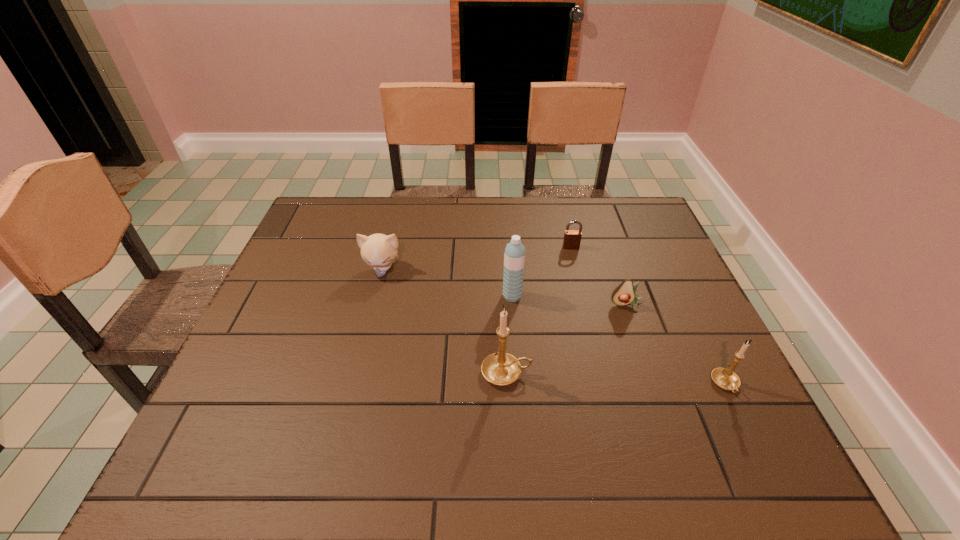
What are the coordinates of `vacant region located 0.050m on the handle side of the shorter candle holder` in the screenshot? It's located at 743,422.

Locate an element on the screen. vacant space located 0.150m on the face of the second farthest object is located at coordinates (370, 321).

Where is `vacant space located on the front-facing side of the padlock`? vacant space located on the front-facing side of the padlock is located at coordinates (594, 340).

In order to click on free space located 0.240m on the seed side of the avocado in this screenshot , I will do `click(657, 393)`.

This screenshot has width=960, height=540. In order to click on vacant space situated on the front of the water bottle in this screenshot , I will do `click(518, 377)`.

In order to click on candle holder that is at the right edge in this screenshot , I will do `click(725, 378)`.

Where is `avocado that is at the right edge`? avocado that is at the right edge is located at coordinates (624, 294).

Identify the location of object at the near right corner. (725, 378).

What are the coordinates of `blank space at the far edge of the desktop` in the screenshot? It's located at (384, 220).

In order to click on free space at the near edge of the desktop in this screenshot , I will do `click(308, 414)`.